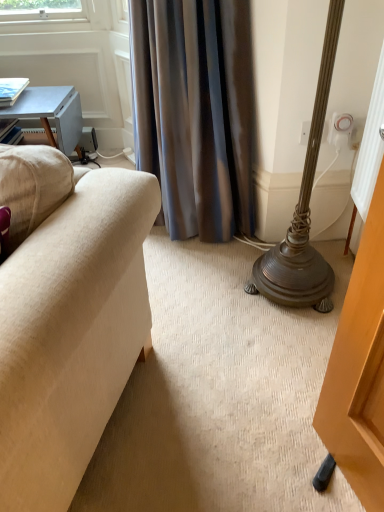
Question: Can you confirm if white plastic electric outlet at upper right is wider than silky gray curtain at center?

Choices:
 (A) no
 (B) yes

Answer: (A)

Question: Is the position of white plastic electric outlet at upper right more distant than that of silky gray curtain at center?

Choices:
 (A) yes
 (B) no

Answer: (A)

Question: Is white plastic electric outlet at upper right shorter than silky gray curtain at center?

Choices:
 (A) yes
 (B) no

Answer: (A)

Question: Does white plastic electric outlet at upper right have a lesser width compared to silky gray curtain at center?

Choices:
 (A) no
 (B) yes

Answer: (B)

Question: Is white plastic electric outlet at upper right positioned before silky gray curtain at center?

Choices:
 (A) no
 (B) yes

Answer: (A)

Question: Considering the positions of point (205, 223) and point (337, 143), is point (205, 223) closer or farther from the camera than point (337, 143)?

Choices:
 (A) farther
 (B) closer

Answer: (A)

Question: Which is correct: silky gray curtain at center is inside white plastic electric outlet at upper right, or outside of it?

Choices:
 (A) inside
 (B) outside

Answer: (B)

Question: Visually, is silky gray curtain at center positioned to the left or to the right of white plastic electric outlet at upper right?

Choices:
 (A) right
 (B) left

Answer: (B)

Question: Considering the positions of silky gray curtain at center and white plastic electric outlet at upper right in the image, is silky gray curtain at center wider or thinner than white plastic electric outlet at upper right?

Choices:
 (A) thin
 (B) wide

Answer: (B)

Question: From the image's perspective, is light blue wooden table at upper left positioned above or below white plastic electric outlet at upper right?

Choices:
 (A) above
 (B) below

Answer: (A)

Question: Relative to white plastic electric outlet at upper right, is light blue wooden table at upper left in front or behind?

Choices:
 (A) front
 (B) behind

Answer: (B)

Question: Based on their positions, is light blue wooden table at upper left located to the left or right of white plastic electric outlet at upper right?

Choices:
 (A) right
 (B) left

Answer: (B)

Question: From a real-world perspective, is light blue wooden table at upper left above or below white plastic electric outlet at upper right?

Choices:
 (A) below
 (B) above

Answer: (A)

Question: Is white plastic electric outlet at upper right in front of or behind light blue wooden table at upper left in the image?

Choices:
 (A) front
 (B) behind

Answer: (A)

Question: From a real-world perspective, is white plastic electric outlet at upper right above or below light blue wooden table at upper left?

Choices:
 (A) above
 (B) below

Answer: (A)